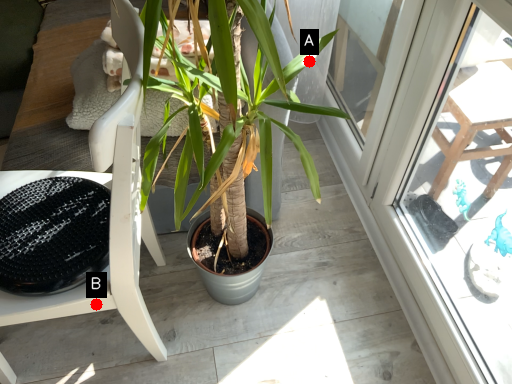
Question: Two points are circled on the image, labeled by A and B beside each circle. Which point is closer to the camera?

Choices:
 (A) A is closer
 (B) B is closer

Answer: (B)